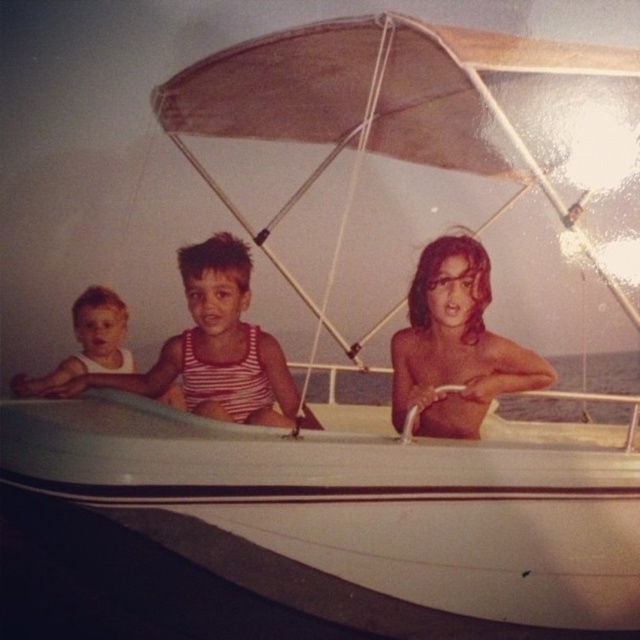
Question: Observing the image, what is the correct spatial positioning of white striped tank top at center in reference to white matte tank top at left?

Choices:
 (A) below
 (B) above

Answer: (B)

Question: Among these points, which one is nearest to the camera?

Choices:
 (A) (115, 312)
 (B) (256, 380)
 (C) (454, 358)

Answer: (B)

Question: Among these points, which one is farthest from the camera?

Choices:
 (A) (112, 349)
 (B) (234, 268)
 (C) (467, 304)

Answer: (A)

Question: Does shiny skin at center lie behind white matte tank top at left?

Choices:
 (A) no
 (B) yes

Answer: (A)

Question: Does white striped tank top at center have a smaller size compared to white matte tank top at left?

Choices:
 (A) yes
 (B) no

Answer: (B)

Question: Which of the following is the closest to the observer?

Choices:
 (A) white striped tank top at center
 (B) shiny skin at center

Answer: (A)